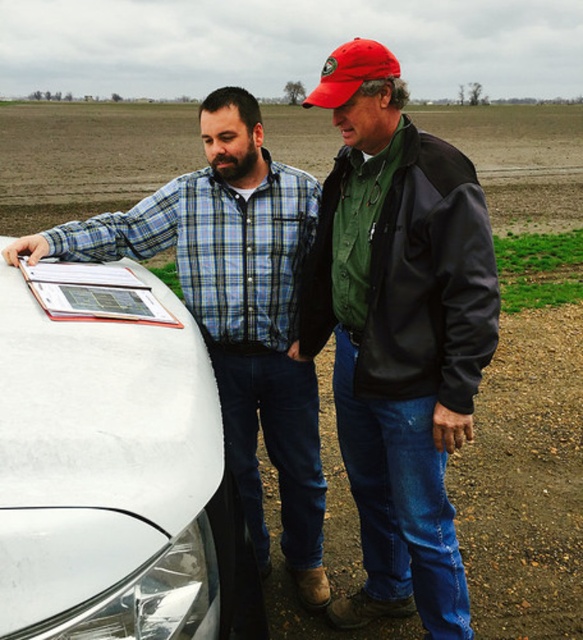
You are a photographer positioned behind the two people in the scene. You want to capture a photo where both the green matte jacket at center and the matte black shirt at left are visible in the frame. Considering their heights, which person should you focus on to ensure both are fully visible?

The green matte jacket at center is much taller than the matte black shirt at left, so focusing on the taller individual wearing the green matte jacket at center will ensure both are fully visible in the photo.

You are a farmer who wants to check the weather forecast on your phone. You are currently facing the green matte jacket at center and the matte black shirt at left. Which person should you approach to ask for help?

The green matte jacket at center is positioned over the matte black shirt at left, meaning the person wearing the green matte jacket at center is closer to you. Approach them first for assistance.

You are a photographer trying to capture both the green matte jacket at center and the matte black shirt at left in a single frame. Based on their sizes in the image, which one would appear smaller in the photo?

The green matte jacket at center appears smaller in the photo because it has a lesser width compared to the matte black shirt at left.